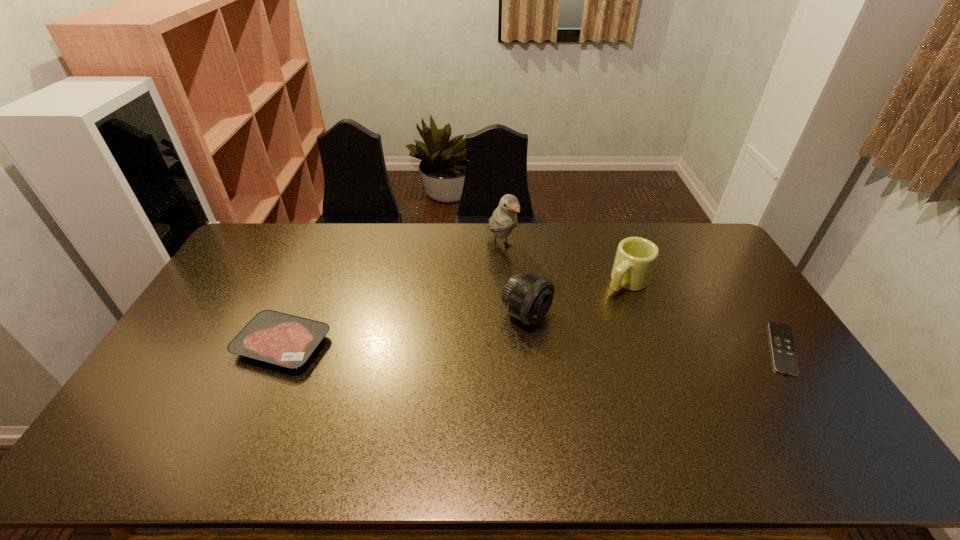
This screenshot has width=960, height=540. I want to click on vacant area between the mug and the shortest object, so click(705, 315).

Locate an element on the screen. free spot between the farthest object and the mug is located at coordinates (564, 265).

Where is `empty space that is in between the bird and the fourth object from left to right`? empty space that is in between the bird and the fourth object from left to right is located at coordinates (564, 265).

In order to click on unoccupied position between the leftmost object and the second object from right to left in this screenshot , I will do `click(455, 313)`.

I want to click on vacant area that lies between the rightmost object and the telephoto lens, so click(x=655, y=332).

Locate an element on the screen. free space between the bird and the fourth tallest object is located at coordinates (392, 296).

You are a GUI agent. You are given a task and a screenshot of the screen. Output one action in this format:
    pyautogui.click(x=<x>, y=<y>)
    Task: Click on the vacant area that lies between the telephoto lens and the shortest object
    This screenshot has height=540, width=960.
    Given the screenshot: What is the action you would take?
    pyautogui.click(x=655, y=332)

Point out which object is positioned as the second nearest to the telephoto lens. Please provide its 2D coordinates. Your answer should be formatted as a tuple, i.e. [(x, y)], where the tuple contains the x and y coordinates of a point satisfying the conditions above.

[(636, 257)]

Locate which object is the closest to the telephoto lens. Please provide its 2D coordinates. Your answer should be formatted as a tuple, i.e. [(x, y)], where the tuple contains the x and y coordinates of a point satisfying the conditions above.

[(504, 219)]

At what (x,y) coordinates should I click in order to perform the action: click on vacant area that satisfies the following two spatial constraints: 1. on the back side of the leftmost object; 2. on the right side of the second object from right to left. Please return your answer as a coordinate pair (x, y). Looking at the image, I should click on (310, 281).